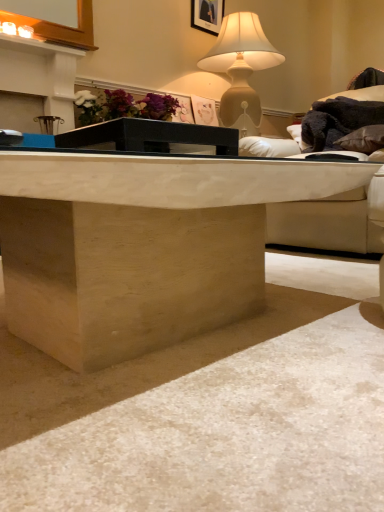
Question: Does white leather couch at upper right contain matte beige lamp at upper center?

Choices:
 (A) yes
 (B) no

Answer: (B)

Question: Can you confirm if white leather couch at upper right is smaller than matte beige lamp at upper center?

Choices:
 (A) no
 (B) yes

Answer: (A)

Question: Can you confirm if white leather couch at upper right is bigger than matte beige lamp at upper center?

Choices:
 (A) yes
 (B) no

Answer: (A)

Question: From the image's perspective, would you say white leather couch at upper right is shown under matte beige lamp at upper center?

Choices:
 (A) no
 (B) yes

Answer: (B)

Question: Is the position of white leather couch at upper right more distant than that of matte beige lamp at upper center?

Choices:
 (A) yes
 (B) no

Answer: (B)

Question: Is white leather couch at upper right not close to matte beige lamp at upper center?

Choices:
 (A) yes
 (B) no

Answer: (A)

Question: Is brown leather pillow at upper right in contact with black glass table at center?

Choices:
 (A) yes
 (B) no

Answer: (B)

Question: Can you confirm if brown leather pillow at upper right is positioned to the right of black glass table at center?

Choices:
 (A) no
 (B) yes

Answer: (B)

Question: Can you confirm if brown leather pillow at upper right is bigger than black glass table at center?

Choices:
 (A) yes
 (B) no

Answer: (A)

Question: Is brown leather pillow at upper right not within black glass table at center?

Choices:
 (A) yes
 (B) no

Answer: (A)

Question: Considering the relative sizes of brown leather pillow at upper right and black glass table at center in the image provided, is brown leather pillow at upper right taller than black glass table at center?

Choices:
 (A) no
 (B) yes

Answer: (B)

Question: Is brown leather pillow at upper right at the left side of black glass table at center?

Choices:
 (A) no
 (B) yes

Answer: (A)

Question: Is black glass table at center wider than brown leather pillow at upper right?

Choices:
 (A) no
 (B) yes

Answer: (A)